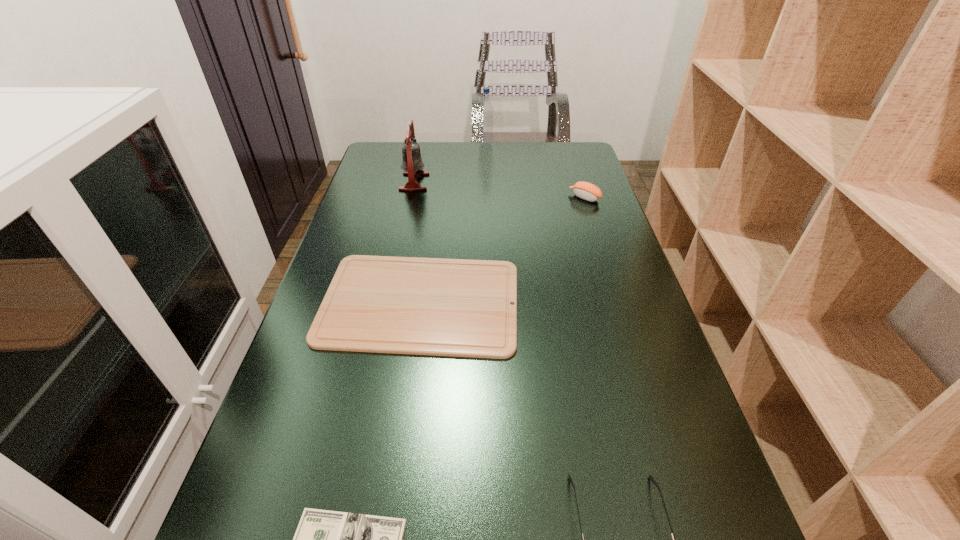
Where is `the farthest object`? Image resolution: width=960 pixels, height=540 pixels. the farthest object is located at coordinates (486, 109).

This screenshot has height=540, width=960. Identify the location of bell. (412, 164).

Image resolution: width=960 pixels, height=540 pixels. I want to click on the third tallest object, so click(584, 190).

Find the location of a particular element. chopping board is located at coordinates pos(380,304).

Find the location of a particular element. The height and width of the screenshot is (540, 960). vacant space located 0.150m on the front of the water bottle is located at coordinates (487, 168).

You are a GUI agent. You are given a task and a screenshot of the screen. Output one action in this format:
    pyautogui.click(x=<x>, y=<y>)
    Task: Click on the blank space located on the right of the bell
    
    Given the screenshot: What is the action you would take?
    pyautogui.click(x=463, y=182)

This screenshot has width=960, height=540. In order to click on blank space located 0.350m on the left of the sushi in this screenshot , I will do `click(455, 198)`.

At what (x,y) coordinates should I click in order to perform the action: click on free space located on the front of the chopping board. Please return your answer as a coordinate pair (x, y). Image resolution: width=960 pixels, height=540 pixels. Looking at the image, I should click on (389, 527).

This screenshot has width=960, height=540. I want to click on water bottle located in the far edge section of the desktop, so (x=486, y=109).

The height and width of the screenshot is (540, 960). What are the coordinates of `bell located in the far edge section of the desktop` in the screenshot? It's located at (412, 164).